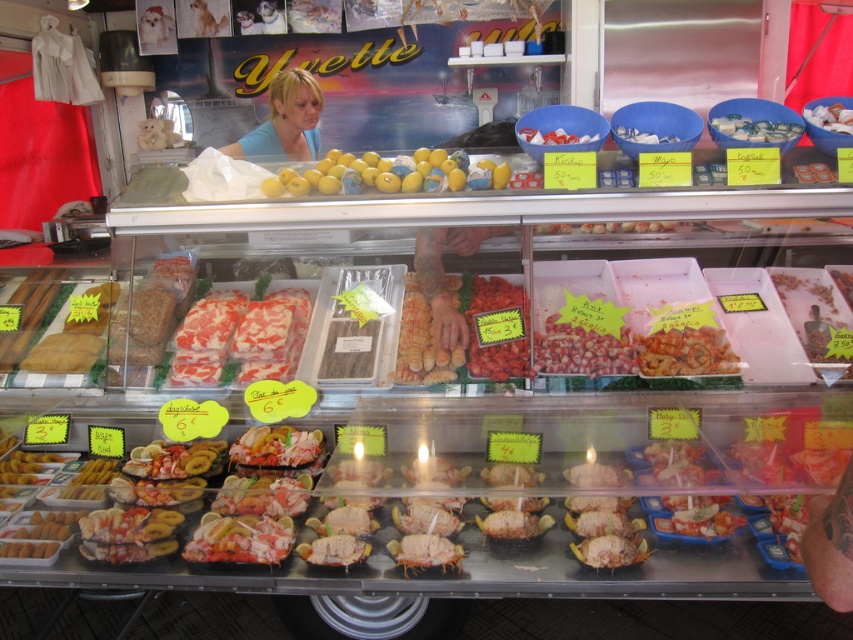
You are a customer at the seafood market stall. You see the white glossy ice cream at center and the white plastic bowl at center. Which one is positioned more to the right?

The white glossy ice cream at center is positioned more to the right than the white plastic bowl at center.

You are a customer at the seafood market stall and want to take a photo of the two points mentioned. Which point, point (543, 144) or point (654, 134), will appear larger in your photo?

Point (543, 144) will appear larger in the photo because it is closer to the camera than point (654, 134).